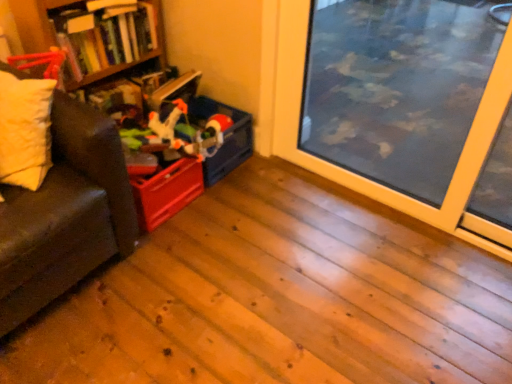
Question: Considering the relative sizes of matte plastic storage box at center-left and wooden bookshelf at upper left in the image provided, is matte plastic storage box at center-left shorter than wooden bookshelf at upper left?

Choices:
 (A) no
 (B) yes

Answer: (A)

Question: Does matte plastic storage box at center-left appear on the left side of wooden bookshelf at upper left?

Choices:
 (A) yes
 (B) no

Answer: (B)

Question: Can you confirm if matte plastic storage box at center-left is smaller than wooden bookshelf at upper left?

Choices:
 (A) no
 (B) yes

Answer: (B)

Question: From the image's perspective, is matte plastic storage box at center-left on top of wooden bookshelf at upper left?

Choices:
 (A) no
 (B) yes

Answer: (A)

Question: Does matte plastic storage box at center-left have a greater width compared to wooden bookshelf at upper left?

Choices:
 (A) yes
 (B) no

Answer: (B)

Question: From their relative heights in the image, would you say matte plastic storage box at center-left is taller or shorter than wooden bookshelf at upper left?

Choices:
 (A) tall
 (B) short

Answer: (A)

Question: Is point (195, 112) positioned closer to the camera than point (74, 4)?

Choices:
 (A) closer
 (B) farther

Answer: (B)

Question: Do you think matte plastic storage box at center-left is within wooden bookshelf at upper left, or outside of it?

Choices:
 (A) inside
 (B) outside

Answer: (B)

Question: In the image, is matte plastic storage box at center-left positioned in front of or behind wooden bookshelf at upper left?

Choices:
 (A) front
 (B) behind

Answer: (B)

Question: Looking at their shapes, would you say matte plastic storage box at center-left is wider or thinner than soft yellow pillow at left?

Choices:
 (A) wide
 (B) thin

Answer: (A)

Question: From the image's perspective, is matte plastic storage box at center-left above or below soft yellow pillow at left?

Choices:
 (A) above
 (B) below

Answer: (A)

Question: From a real-world perspective, is matte plastic storage box at center-left positioned above or below soft yellow pillow at left?

Choices:
 (A) above
 (B) below

Answer: (B)

Question: Does point (251, 130) appear closer or farther from the camera than point (34, 124)?

Choices:
 (A) closer
 (B) farther

Answer: (B)

Question: Relative to matte plastic storage box at center-left, is transparent glass window screen at center right in front or behind?

Choices:
 (A) behind
 (B) front

Answer: (B)

Question: From a real-world perspective, is transparent glass window screen at center right above or below matte plastic storage box at center-left?

Choices:
 (A) below
 (B) above

Answer: (B)